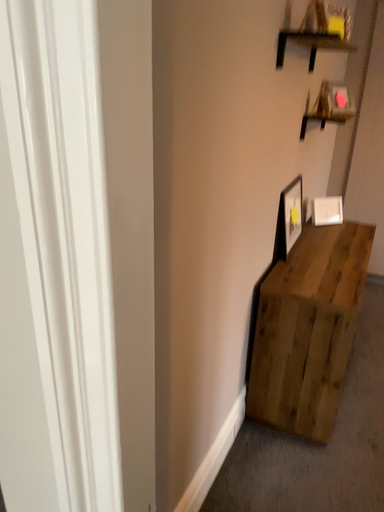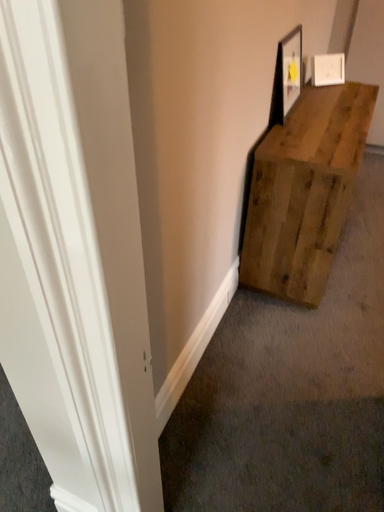
Question: Which way did the camera rotate in the video?

Choices:
 (A) rotated upward
 (B) rotated downward

Answer: (B)